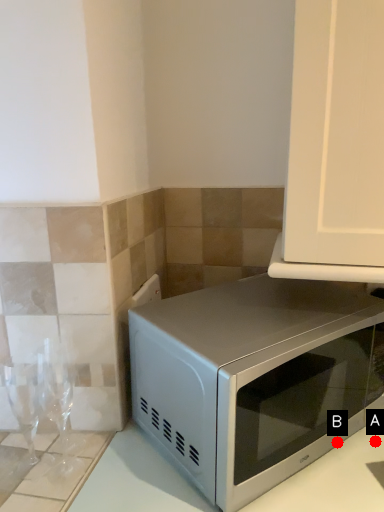
Question: Two points are circled on the image, labeled by A and B beside each circle. Which point appears farthest from the camera in this image?

Choices:
 (A) A is further
 (B) B is further

Answer: (A)